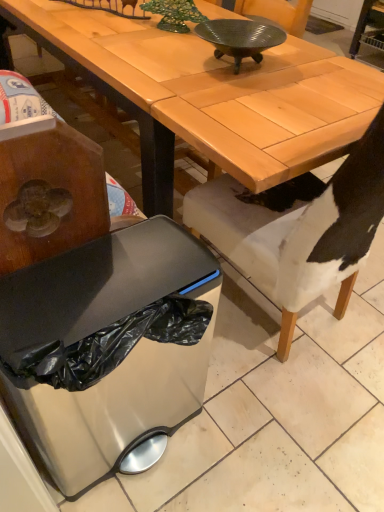
Question: Is matte wood desk at center far away from satin silver trash can at lower left?

Choices:
 (A) yes
 (B) no

Answer: (B)

Question: From the image's perspective, is matte wood desk at center on top of satin silver trash can at lower left?

Choices:
 (A) yes
 (B) no

Answer: (A)

Question: From a real-world perspective, is matte wood desk at center located beneath satin silver trash can at lower left?

Choices:
 (A) yes
 (B) no

Answer: (B)

Question: Does matte wood desk at center have a greater height compared to satin silver trash can at lower left?

Choices:
 (A) yes
 (B) no

Answer: (A)

Question: Considering the relative positions of matte wood desk at center and satin silver trash can at lower left in the image provided, is matte wood desk at center in front of satin silver trash can at lower left?

Choices:
 (A) no
 (B) yes

Answer: (A)

Question: Considering their positions, is metallic ribbed bowl at center located in front of or behind white fabric chair at lower right?

Choices:
 (A) behind
 (B) front

Answer: (A)

Question: Is metallic ribbed bowl at center situated inside white fabric chair at lower right or outside?

Choices:
 (A) outside
 (B) inside

Answer: (A)

Question: Looking at their shapes, would you say metallic ribbed bowl at center is wider or thinner than white fabric chair at lower right?

Choices:
 (A) wide
 (B) thin

Answer: (B)

Question: Is metallic ribbed bowl at center taller or shorter than white fabric chair at lower right?

Choices:
 (A) tall
 (B) short

Answer: (B)

Question: Based on their sizes in the image, would you say white fabric chair at lower right is bigger or smaller than matte wood desk at center?

Choices:
 (A) big
 (B) small

Answer: (B)

Question: Considering the positions of white fabric chair at lower right and matte wood desk at center in the image, is white fabric chair at lower right wider or thinner than matte wood desk at center?

Choices:
 (A) thin
 (B) wide

Answer: (A)

Question: Does point (230, 224) appear closer or farther from the camera than point (240, 161)?

Choices:
 (A) closer
 (B) farther

Answer: (B)

Question: Is white fabric chair at lower right to the left or to the right of matte wood desk at center in the image?

Choices:
 (A) left
 (B) right

Answer: (B)

Question: In terms of width, does satin silver trash can at lower left look wider or thinner when compared to white fabric chair at lower right?

Choices:
 (A) thin
 (B) wide

Answer: (A)

Question: Relative to white fabric chair at lower right, is satin silver trash can at lower left in front or behind?

Choices:
 (A) behind
 (B) front

Answer: (A)